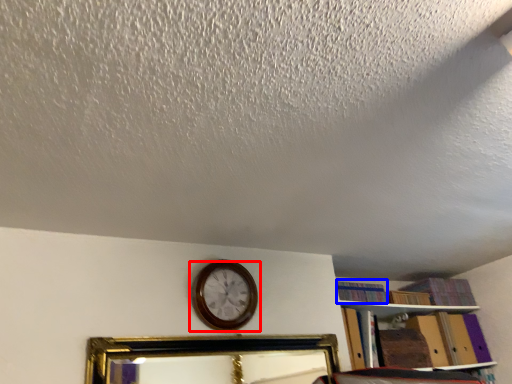
Question: Among these objects, which one is farthest to the camera, wall clock (highlighted by a red box) or book (highlighted by a blue box)?

Choices:
 (A) wall clock
 (B) book

Answer: (B)